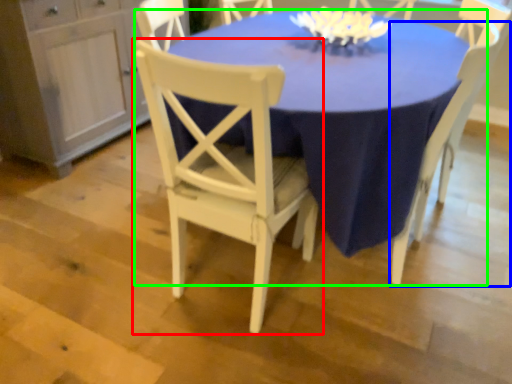
Question: Which object is positioned closest to chair (highlighted by a red box)? Select from chair (highlighted by a blue box) and table (highlighted by a green box).

Choices:
 (A) chair
 (B) table

Answer: (B)